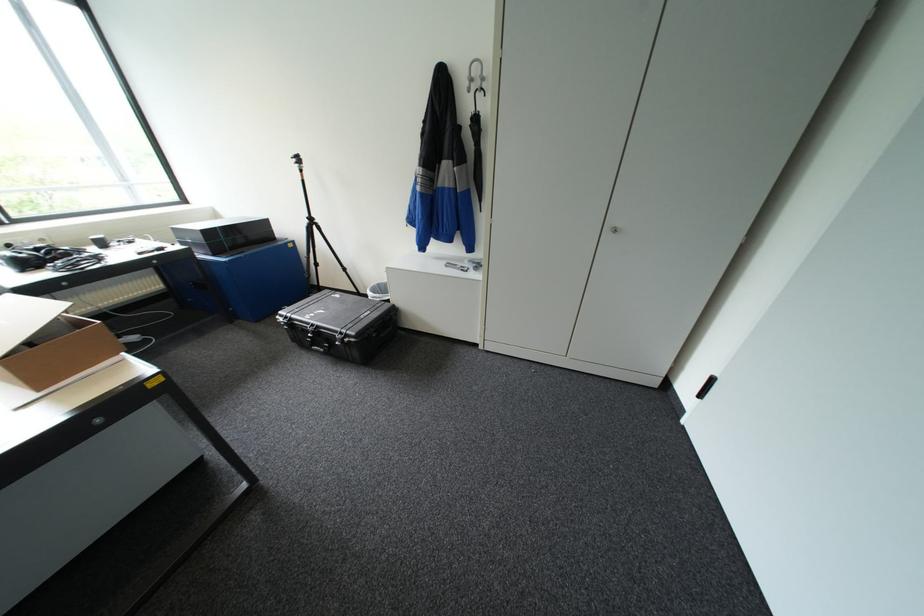
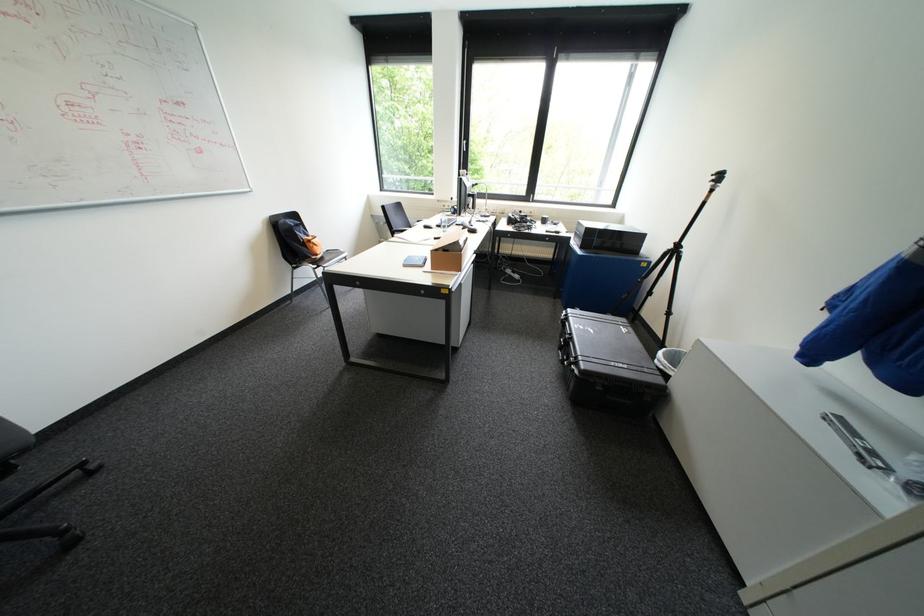
Find the pixel in the second image that matches point 345,342 in the first image.

(574, 361)